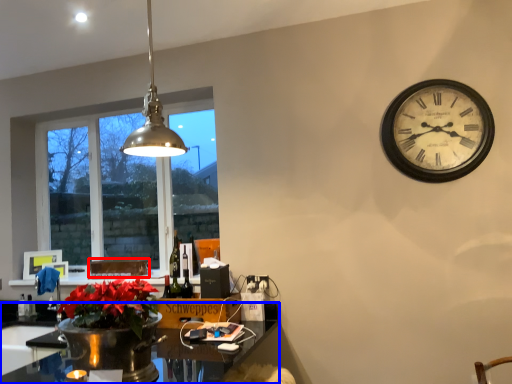
Question: Which of the following is the closest to the observer, cardboard box (highlighted by a red box) or desk (highlighted by a blue box)?

Choices:
 (A) cardboard box
 (B) desk

Answer: (B)